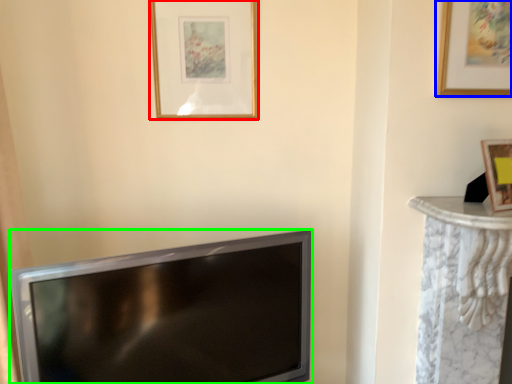
Question: Based on their relative distances, which object is nearer to picture frame (highlighted by a red box)? Choose from picture frame (highlighted by a blue box) and television (highlighted by a green box).

Choices:
 (A) picture frame
 (B) television

Answer: (B)